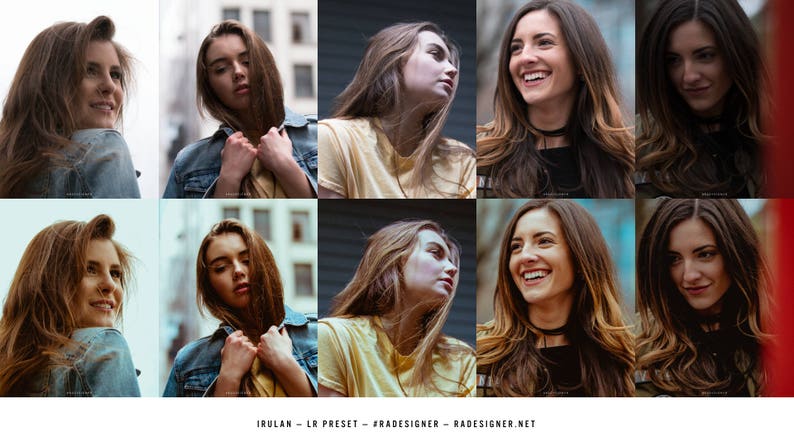
This screenshot has height=447, width=794. I want to click on portraits, so click(692, 256), click(542, 260), click(426, 255), click(222, 278), click(98, 281), click(94, 95), click(229, 74), click(418, 69), click(565, 71), click(683, 85).